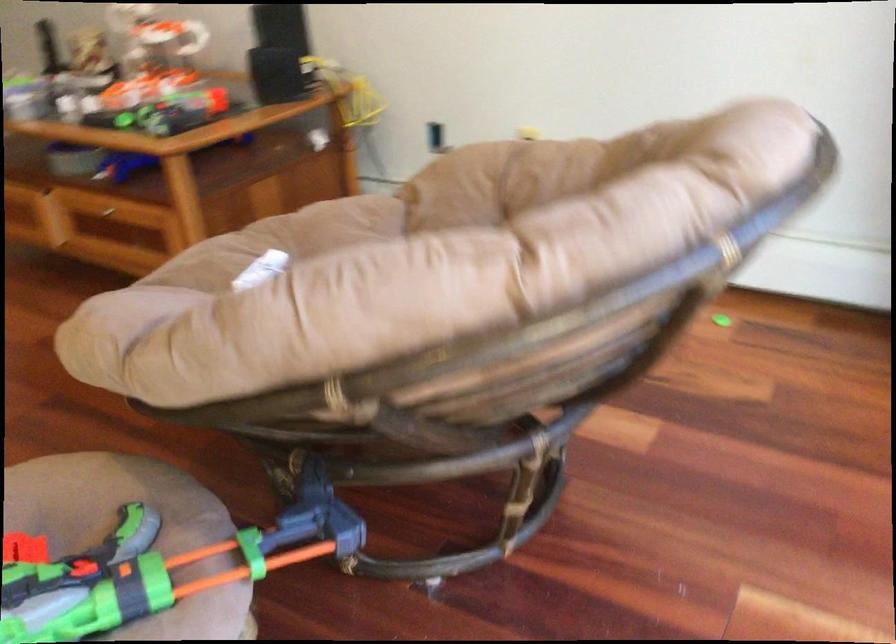
The image size is (896, 644). Find the location of `green foam disc`. green foam disc is located at coordinates (159, 567).